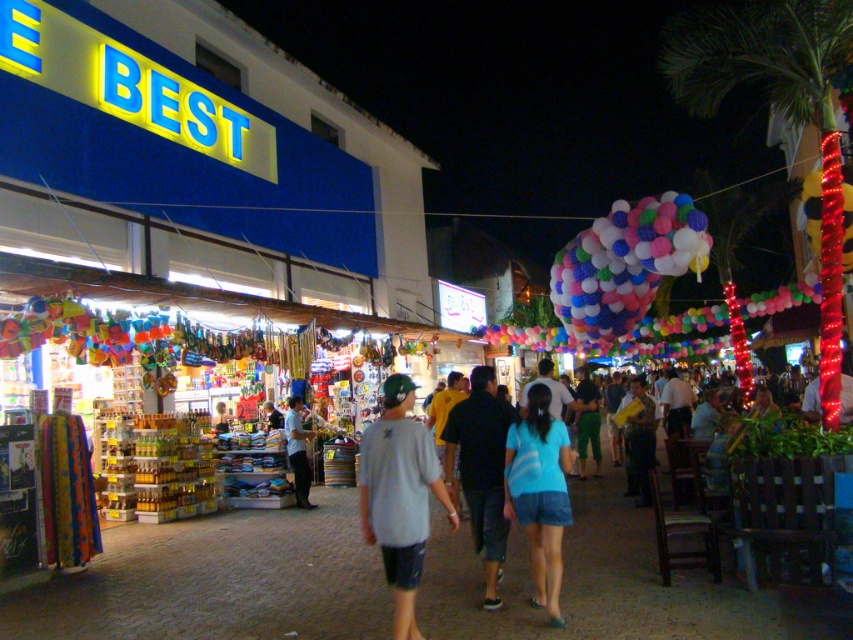
You are a customer at the market and want to buy the light blue denim shorts at center. However, you notice the multicolored fabric balloons at center are blocking your view of the price tag. Can you move the balloons to see the price?

The light blue denim shorts at center is in front of the multicolored fabric balloons at center, so the balloons are behind the shorts and not blocking the view. You don not need to move them to see the price tag.

You are a customer standing in the market and want to find the light blue denim shorts at center. According to the image coordinates, where exactly should you look?

The light blue denim shorts at center are located at the 2D coordinates point (402, 493).